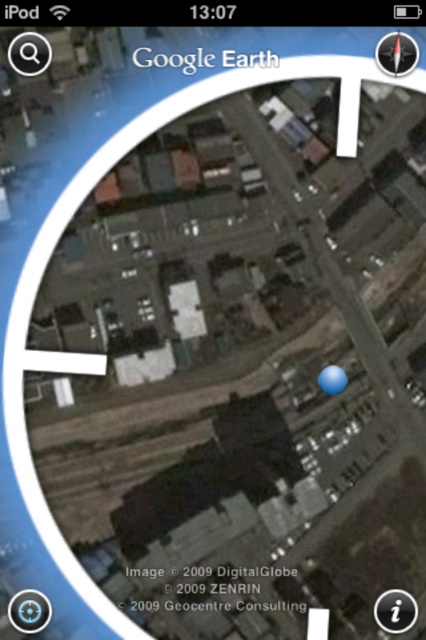
You are using an iPod to view a Google Earth map of a residential area. You notice two elements on the screen. One is a white paper at center, and the other is a transparent blue circle at center. Which of these two elements is taller?

The transparent blue circle at center is taller than the white paper at center.

You are using Google Earth on your iPod and want to determine the spatial relationship between two points marked on the map. The points are labeled as point 1 at coordinates (x=408, y=618) and point 2 at coordinates (x=380, y=52). Based on the satellite view provided, which point is closer to the camera lens capturing the image?

Point 1 at coordinates (x=408, y=618) is further to the camera than point 2 at coordinates (x=380, y=52), so point 2 is closer to the camera lens.